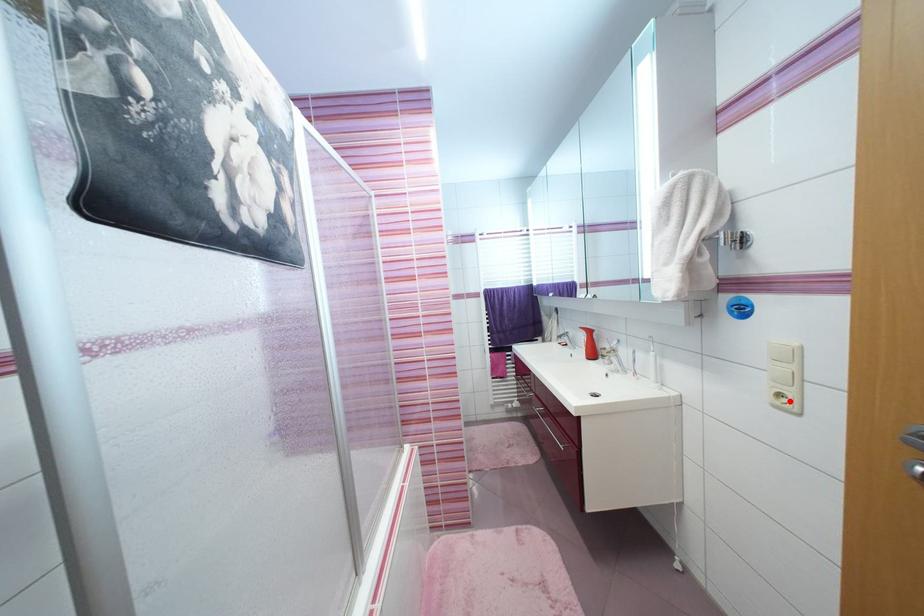
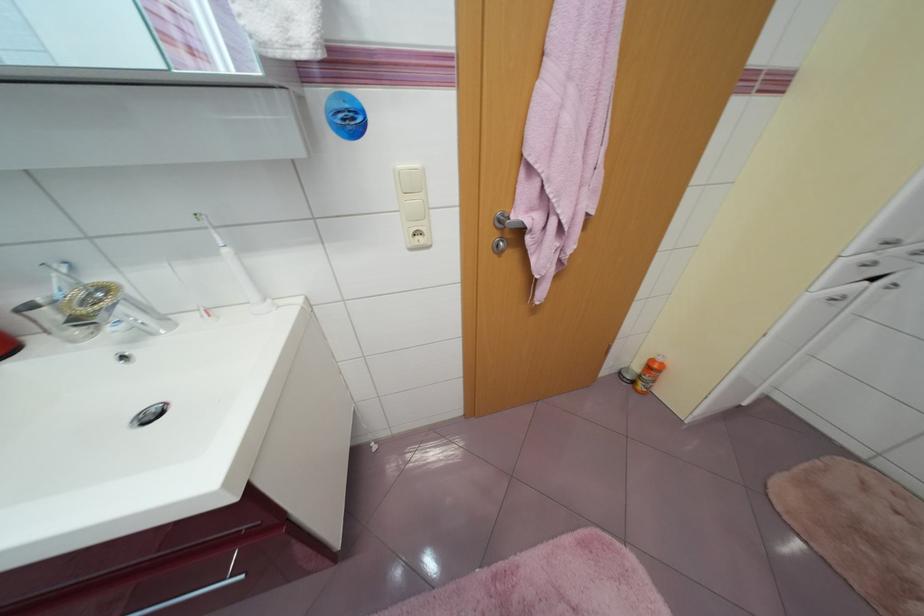
Find the pixel in the second image that matches the highlighted location in the first image.

(423, 238)